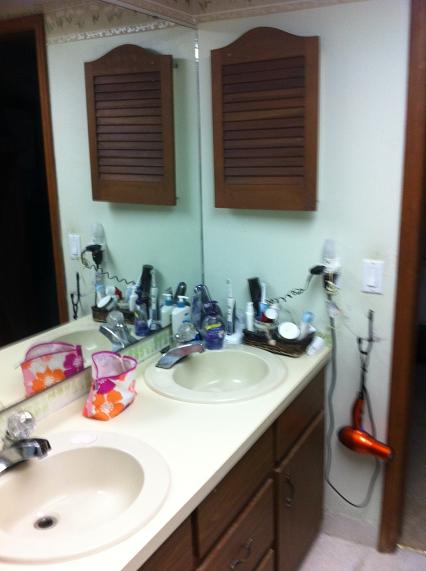
The image size is (426, 571). Find the location of `the right porcelain sink`. the right porcelain sink is located at coordinates (216, 365).